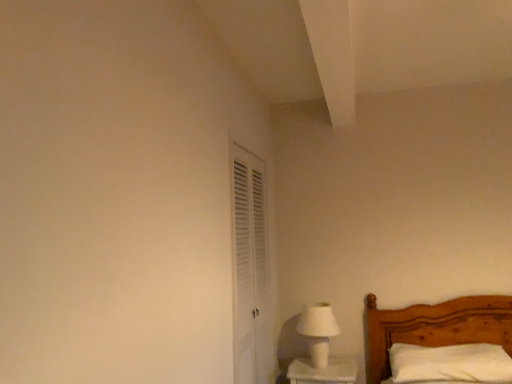
Question: Does white soft pillow at lower right appear on the right side of white louvered door at center-left?

Choices:
 (A) yes
 (B) no

Answer: (A)

Question: Is white soft pillow at lower right looking in the opposite direction of white louvered door at center-left?

Choices:
 (A) no
 (B) yes

Answer: (A)

Question: Can you confirm if white soft pillow at lower right is shorter than white louvered door at center-left?

Choices:
 (A) yes
 (B) no

Answer: (A)

Question: Does white soft pillow at lower right have a smaller size compared to white louvered door at center-left?

Choices:
 (A) yes
 (B) no

Answer: (A)

Question: Is white soft pillow at lower right in front of white louvered door at center-left?

Choices:
 (A) yes
 (B) no

Answer: (B)

Question: From a real-world perspective, is white louvered door at center-left above or below white soft pillow at lower right?

Choices:
 (A) above
 (B) below

Answer: (A)

Question: Considering the relative positions of white louvered door at center-left and white soft pillow at lower right in the image provided, is white louvered door at center-left to the left or to the right of white soft pillow at lower right?

Choices:
 (A) right
 (B) left

Answer: (B)

Question: Relative to white soft pillow at lower right, is white louvered door at center-left in front or behind?

Choices:
 (A) behind
 (B) front

Answer: (B)

Question: Considering the positions of white louvered door at center-left and white soft pillow at lower right in the image, is white louvered door at center-left bigger or smaller than white soft pillow at lower right?

Choices:
 (A) big
 (B) small

Answer: (A)

Question: Is white matte table lamp at lower right in front of or behind white louvered door at center-left in the image?

Choices:
 (A) behind
 (B) front

Answer: (A)

Question: In terms of height, does white matte table lamp at lower right look taller or shorter compared to white louvered door at center-left?

Choices:
 (A) tall
 (B) short

Answer: (B)

Question: Which is correct: white matte table lamp at lower right is inside white louvered door at center-left, or outside of it?

Choices:
 (A) outside
 (B) inside

Answer: (A)

Question: Is white matte table lamp at lower right bigger or smaller than white louvered door at center-left?

Choices:
 (A) small
 (B) big

Answer: (A)

Question: Is white matte table lamp at lower right in front of or behind white soft pillow at lower right in the image?

Choices:
 (A) behind
 (B) front

Answer: (A)

Question: In the image, is white matte table lamp at lower right on the left side or the right side of white soft pillow at lower right?

Choices:
 (A) right
 (B) left

Answer: (B)